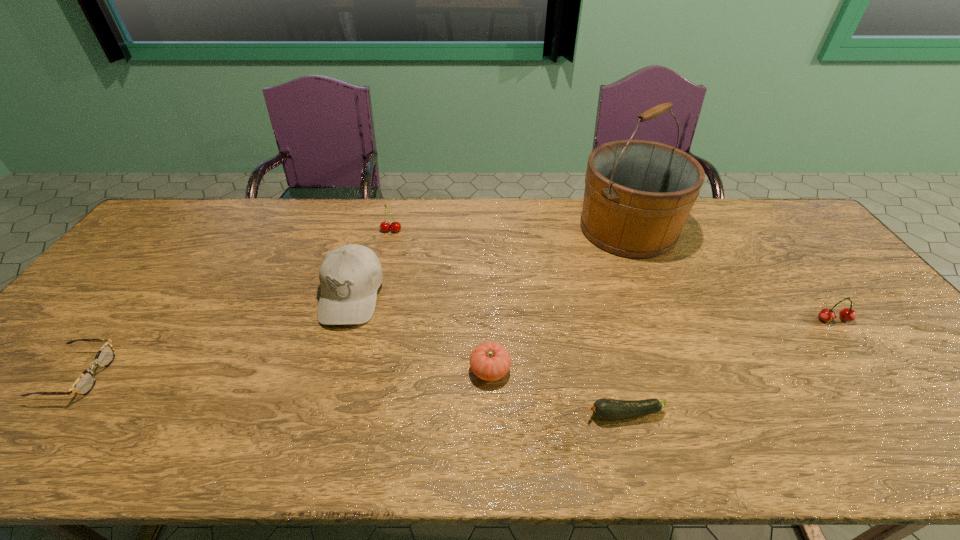
What are the coordinates of `the tallest object` in the screenshot? It's located at (638, 194).

Image resolution: width=960 pixels, height=540 pixels. In order to click on the second tallest object in this screenshot , I will do `click(350, 275)`.

This screenshot has height=540, width=960. I want to click on the left cherry, so click(385, 226).

The image size is (960, 540). I want to click on the rightmost object, so click(x=847, y=314).

The image size is (960, 540). I want to click on the right cherry, so click(847, 314).

Find the location of a particular element. tomato is located at coordinates (490, 361).

Locate an element on the screen. This screenshot has width=960, height=540. the fourth object from left to right is located at coordinates (490, 361).

In order to click on spectacles in this screenshot , I will do `click(86, 381)`.

The width and height of the screenshot is (960, 540). In order to click on zucchini in this screenshot , I will do `click(606, 409)`.

Where is `vacant space located on the left of the bucket`? This screenshot has height=540, width=960. vacant space located on the left of the bucket is located at coordinates (496, 229).